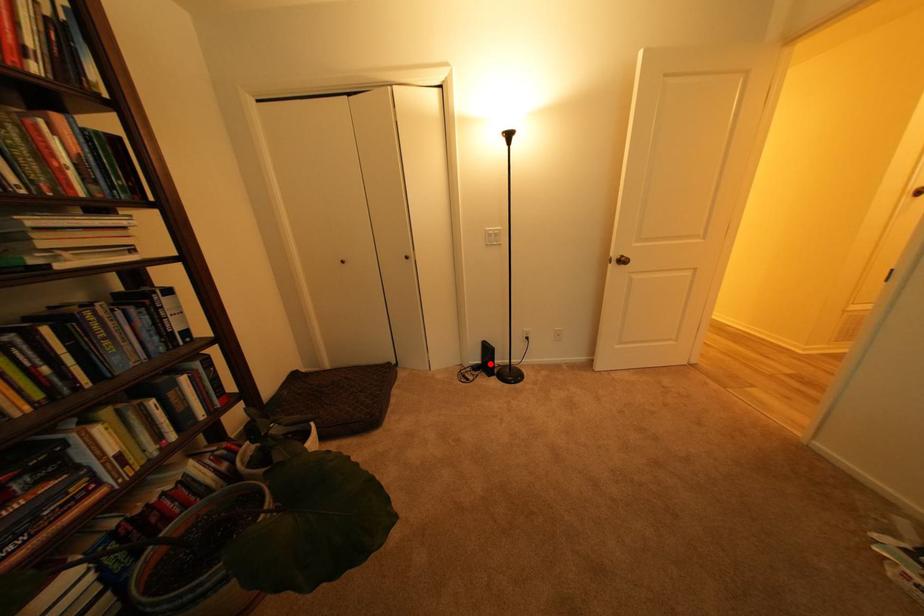
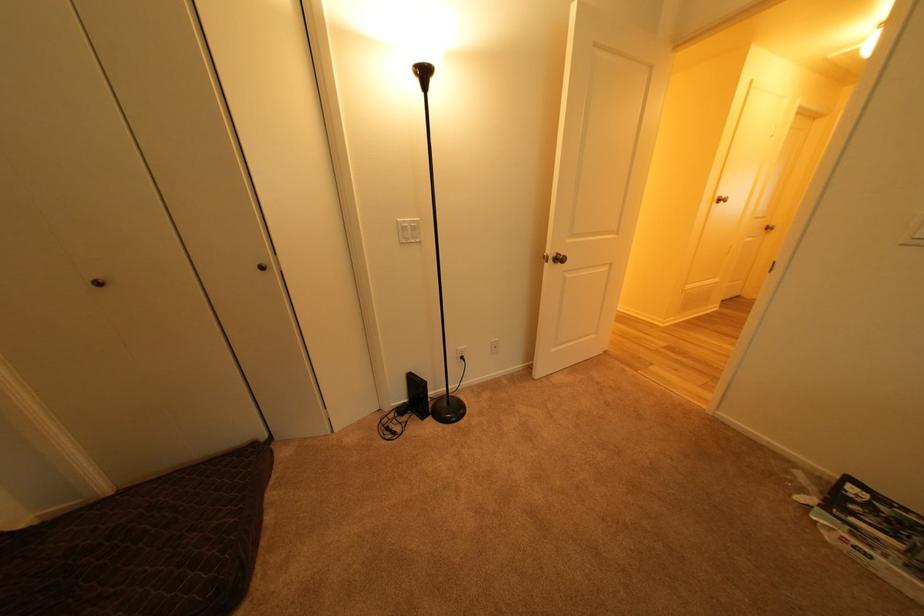
Find the pixel in the second image that matches the highlighted location in the first image.

(417, 402)